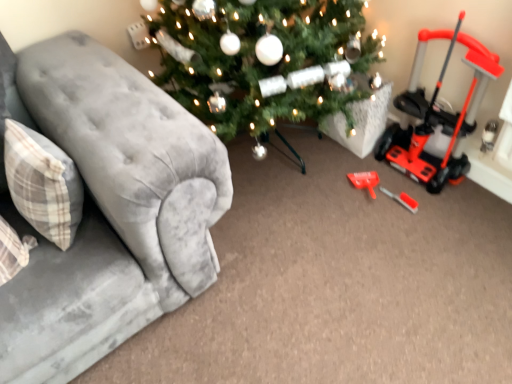
You are a GUI agent. You are given a task and a screenshot of the screen. Output one action in this format:
    pyautogui.click(x=<x>, y=<y>)
    Task: Click on the orange plastic push mower at right
    Image resolution: width=512 pixels, height=384 pixels.
    Given the screenshot: What is the action you would take?
    pyautogui.click(x=439, y=115)

Measure the distance between velvet gray couch at left and camera.

A distance of 1.01 meters exists between velvet gray couch at left and camera.

Where is `plaid fabric pillow at left`? The height and width of the screenshot is (384, 512). plaid fabric pillow at left is located at coordinates (42, 183).

Identify the location of orange plastic push mower at right. The image size is (512, 384). (439, 115).

From a real-world perspective, which object rests below the other?

orange plastic push mower at right, from a real-world perspective.

Between plaid fabric pillow at left and orange plastic push mower at right, which one appears on the right side from the viewer's perspective?

orange plastic push mower at right.

From the image's perspective, who appears lower, plaid fabric pillow at left or orange plastic push mower at right?

plaid fabric pillow at left, from the image's perspective.

Is the position of red plastic screwdriver at lower right more distant than that of plaid fabric pillow at left?

Yes, red plastic screwdriver at lower right is further from the camera.

Is red plastic screwdriver at lower right far from plaid fabric pillow at left?

red plastic screwdriver at lower right is positioned a significant distance from plaid fabric pillow at left.

From the image's perspective, which object appears higher, red plastic screwdriver at lower right or plaid fabric pillow at left?

plaid fabric pillow at left, from the image's perspective.

Is orange plastic push mower at right touching velvet gray couch at left?

No, orange plastic push mower at right is not touching velvet gray couch at left.

Looking at this image, from the image's perspective, relative to velvet gray couch at left, is orange plastic push mower at right above or below?

Clearly, from the image's perspective, orange plastic push mower at right is above velvet gray couch at left.

Between orange plastic push mower at right and velvet gray couch at left, which one has smaller width?

orange plastic push mower at right is thinner.

Which object is closer to the camera, velvet gray couch at left or red plastic screwdriver at lower right?

velvet gray couch at left is in front.

From a real-world perspective, who is located higher, velvet gray couch at left or red plastic screwdriver at lower right?

From a 3D spatial view, velvet gray couch at left is above.

Is velvet gray couch at left inside or outside of red plastic screwdriver at lower right?

velvet gray couch at left cannot be found inside red plastic screwdriver at lower right.

Is velvet gray couch at left positioned with its back to red plastic screwdriver at lower right?

velvet gray couch at left is not turned away from red plastic screwdriver at lower right.

Is plaid fabric pillow at left aimed at red plastic screwdriver at lower right?

No.

The image size is (512, 384). In order to click on pillow in front of the red plastic screwdriver at lower right in this screenshot , I will do `click(42, 183)`.

Can you confirm if plaid fabric pillow at left is taller than red plastic screwdriver at lower right?

Yes.

Can you confirm if velvet gray couch at left is thinner than orange plastic push mower at right?

In fact, velvet gray couch at left might be wider than orange plastic push mower at right.

From the image's perspective, which one is positioned lower, velvet gray couch at left or orange plastic push mower at right?

velvet gray couch at left is shown below in the image.

Is velvet gray couch at left in front of orange plastic push mower at right?

Yes.

Considering the relative sizes of red plastic screwdriver at lower right and orange plastic push mower at right in the image provided, is red plastic screwdriver at lower right smaller than orange plastic push mower at right?

Indeed, red plastic screwdriver at lower right has a smaller size compared to orange plastic push mower at right.

Considering the sizes of red plastic screwdriver at lower right and orange plastic push mower at right in the image, is red plastic screwdriver at lower right taller or shorter than orange plastic push mower at right?

Clearly, red plastic screwdriver at lower right is shorter compared to orange plastic push mower at right.

From the picture: Between red plastic screwdriver at lower right and orange plastic push mower at right, which one has larger width?

Wider between the two is orange plastic push mower at right.

From the image's perspective, is red plastic screwdriver at lower right above or below orange plastic push mower at right?

Based on their image positions, red plastic screwdriver at lower right is located beneath orange plastic push mower at right.

Find the location of a particular element. pillow located above the orange plastic push mower at right (from a real-world perspective) is located at coordinates (42, 183).

Identify the location of pillow on the left side of red plastic screwdriver at lower right. This screenshot has height=384, width=512. (42, 183).

Considering their positions, is orange plastic push mower at right positioned further to velvet gray couch at left than plaid fabric pillow at left?

orange plastic push mower at right is positioned further to the anchor velvet gray couch at left.

Looking at the image, which one is located closer to velvet gray couch at left, red plastic screwdriver at lower right or orange plastic push mower at right?

Based on the image, red plastic screwdriver at lower right appears to be nearer to velvet gray couch at left.

Estimate the real-world distances between objects in this image. Which object is further from red plastic screwdriver at lower right, velvet gray couch at left or plaid fabric pillow at left?

plaid fabric pillow at left is positioned further to the anchor red plastic screwdriver at lower right.

When comparing their distances from red plastic screwdriver at lower right, does plaid fabric pillow at left or velvet gray couch at left seem further?

Among the two, plaid fabric pillow at left is located further to red plastic screwdriver at lower right.

Considering their positions, is red plastic screwdriver at lower right positioned further to plaid fabric pillow at left than velvet gray couch at left?

Result: The object further to plaid fabric pillow at left is red plastic screwdriver at lower right.

From the image, which object appears to be nearer to velvet gray couch at left, plaid fabric pillow at left or red plastic screwdriver at lower right?

Among the two, plaid fabric pillow at left is located nearer to velvet gray couch at left.

Considering their positions, is velvet gray couch at left positioned closer to red plastic screwdriver at lower right than orange plastic push mower at right?

orange plastic push mower at right.

From the image, which object appears to be farther from red plastic screwdriver at lower right, orange plastic push mower at right or velvet gray couch at left?

velvet gray couch at left lies further to red plastic screwdriver at lower right than the other object.

Where is `pillow situated between velvet gray couch at left and red plastic screwdriver at lower right from left to right`? pillow situated between velvet gray couch at left and red plastic screwdriver at lower right from left to right is located at coordinates (42, 183).

This screenshot has height=384, width=512. What are the coordinates of `pillow located between velvet gray couch at left and orange plastic push mower at right in the left-right direction` in the screenshot? It's located at (42, 183).

The height and width of the screenshot is (384, 512). Identify the location of toy between velvet gray couch at left and orange plastic push mower at right in the horizontal direction. (402, 200).

Where is `toy situated between plaid fabric pillow at left and orange plastic push mower at right from left to right`? The width and height of the screenshot is (512, 384). toy situated between plaid fabric pillow at left and orange plastic push mower at right from left to right is located at coordinates (402, 200).